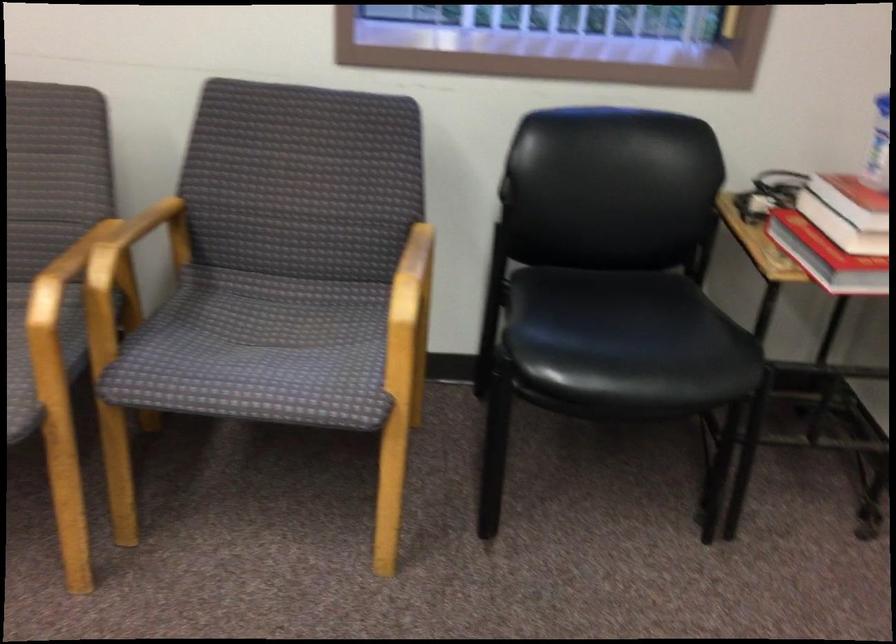
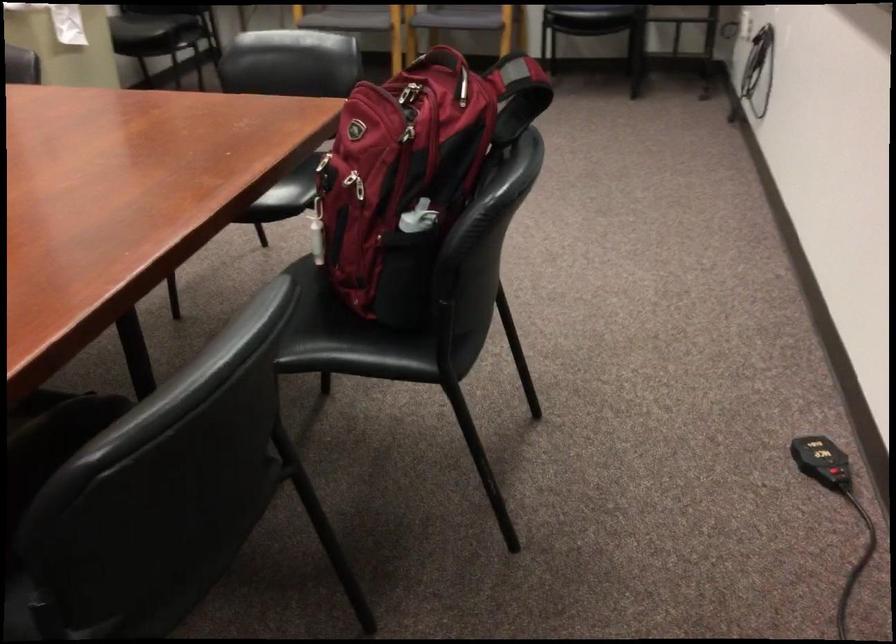
Question: The images are taken continuously from a first-person perspective. In which direction are you moving?

Choices:
 (A) Left
 (B) Right
 (C) Forward
 (D) Backward

Answer: (D)